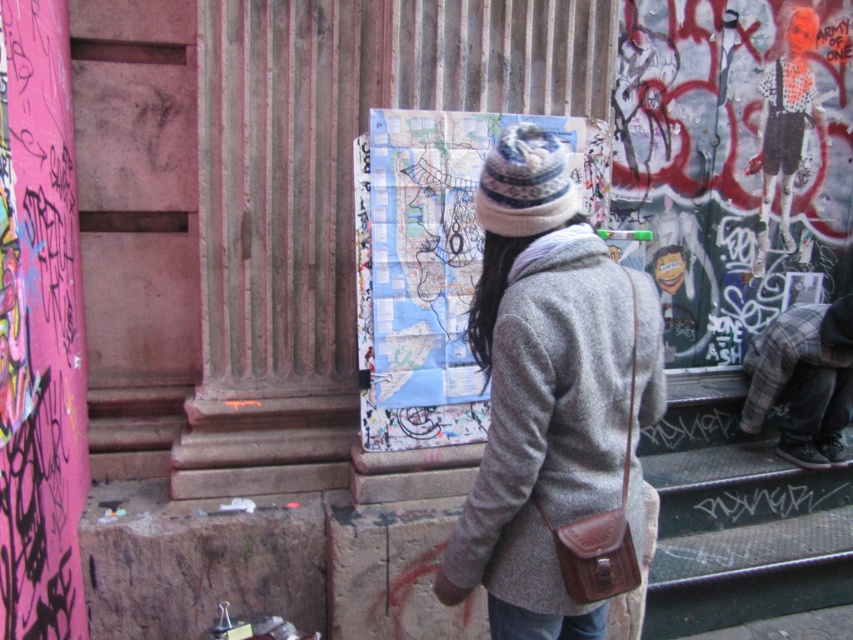
Can you confirm if black metal stairs at lower right is positioned below plaid fabric pants at lower right?

Yes, black metal stairs at lower right is below plaid fabric pants at lower right.

Is point (717, 429) more distant than point (830, 312)?

Yes, it is behind point (830, 312).

Where is `black metal stairs at lower right`? The width and height of the screenshot is (853, 640). black metal stairs at lower right is located at coordinates (740, 525).

Based on the photo, can you confirm if gray woolen coat at center is positioned to the right of plaid fabric pants at lower right?

No, gray woolen coat at center is not to the right of plaid fabric pants at lower right.

Which is above, gray woolen coat at center or plaid fabric pants at lower right?

gray woolen coat at center is higher up.

Which is in front, point (469, 561) or point (766, 346)?

Point (469, 561)

Find the location of a particular element. The image size is (853, 640). gray woolen coat at center is located at coordinates (552, 412).

Which is behind, point (677, 490) or point (497, 634)?

The point (677, 490) is more distant.

Can you confirm if black metal stairs at lower right is positioned to the left of blue denim jeans at lower center?

No, black metal stairs at lower right is not to the left of blue denim jeans at lower center.

Does point (680, 435) lie behind point (489, 628)?

Yes, point (680, 435) is behind point (489, 628).

This screenshot has height=640, width=853. I want to click on black metal stairs at lower right, so click(740, 525).